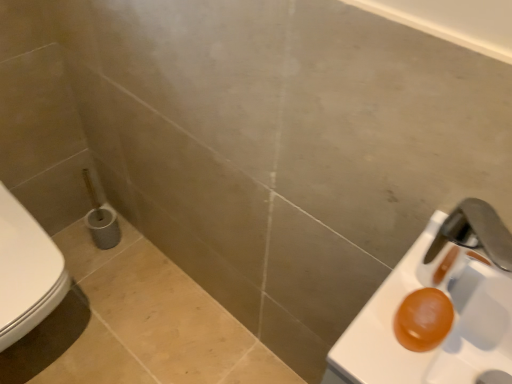
Question: Considering the positions of orange translucent soap at right and white glossy toilet at left in the image, is orange translucent soap at right taller or shorter than white glossy toilet at left?

Choices:
 (A) short
 (B) tall

Answer: (A)

Question: In the image, is orange translucent soap at right on the left side or the right side of white glossy toilet at left?

Choices:
 (A) left
 (B) right

Answer: (B)

Question: From a real-world perspective, is orange translucent soap at right physically located above or below white glossy toilet at left?

Choices:
 (A) above
 (B) below

Answer: (A)

Question: Is white glossy toilet at left spatially inside orange translucent soap at right, or outside of it?

Choices:
 (A) inside
 (B) outside

Answer: (B)

Question: From a real-world perspective, is white glossy toilet at left positioned above or below orange translucent soap at right?

Choices:
 (A) below
 (B) above

Answer: (A)

Question: Is point [12, 251] closer or farther from the camera than point [482, 261]?

Choices:
 (A) closer
 (B) farther

Answer: (B)

Question: Is white glossy toilet at left in front of or behind orange translucent soap at right in the image?

Choices:
 (A) front
 (B) behind

Answer: (B)